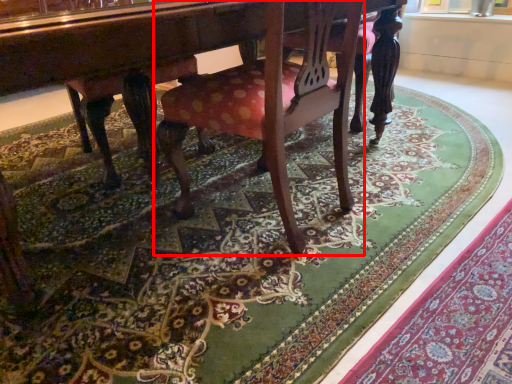
Question: From the image, what is the correct spatial relationship of chair (annotated by the red box) in relation to mat?

Choices:
 (A) right
 (B) left

Answer: (B)